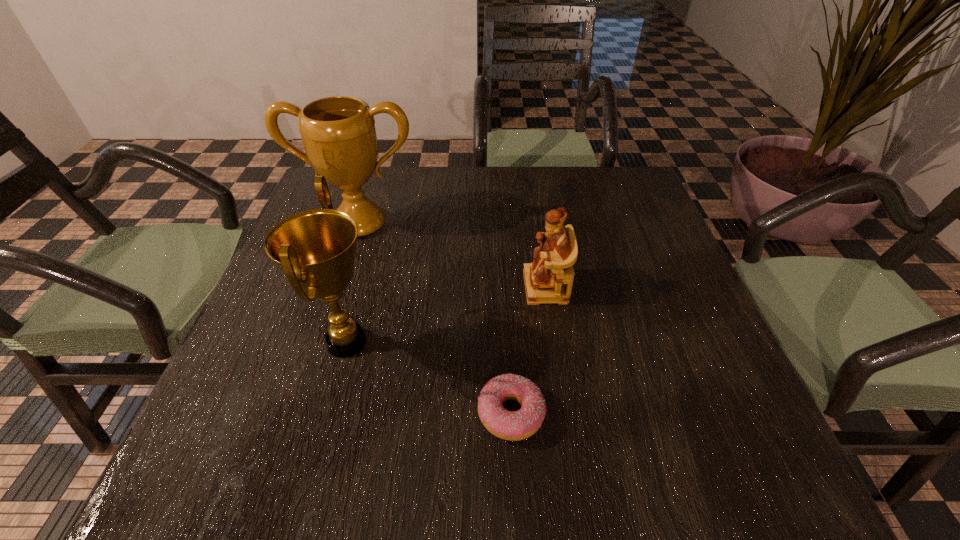
Image resolution: width=960 pixels, height=540 pixels. I want to click on object situated at the far edge, so click(x=338, y=133).

Where is `object that is at the near edge`? This screenshot has height=540, width=960. object that is at the near edge is located at coordinates (518, 425).

Identify the location of object present at the far left corner. (338, 133).

In the image, there is a desktop. Where is `free space at the far edge`? free space at the far edge is located at coordinates (414, 205).

Identify the location of vacant point at the near edge. (372, 450).

Find the location of a particular element. The height and width of the screenshot is (540, 960). vacant space at the left edge of the desktop is located at coordinates 262,367.

Find the location of a particular element. The width and height of the screenshot is (960, 540). blank space at the right edge of the desktop is located at coordinates (626, 314).

You are a GUI agent. You are given a task and a screenshot of the screen. Output one action in this format:
    pyautogui.click(x=<x>, y=<y>)
    Task: Click on the blank space at the far right corner of the desktop
    
    Given the screenshot: What is the action you would take?
    pyautogui.click(x=599, y=186)

The height and width of the screenshot is (540, 960). I want to click on vacant area that lies between the nearer award and the farthest object, so click(x=353, y=282).

This screenshot has width=960, height=540. Identify the location of free space between the nearer award and the second shortest object. (446, 314).